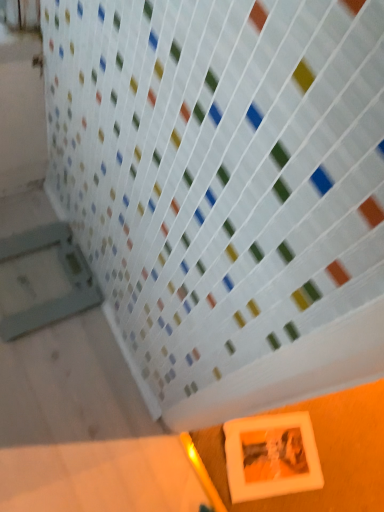
The height and width of the screenshot is (512, 384). Describe the element at coordinates (271, 456) in the screenshot. I see `white matte picture frame at lower right` at that location.

The width and height of the screenshot is (384, 512). Identify the location of white matte picture frame at lower right. (271, 456).

Identify the location of white matte picture frame at lower right. Image resolution: width=384 pixels, height=512 pixels. tap(271, 456).